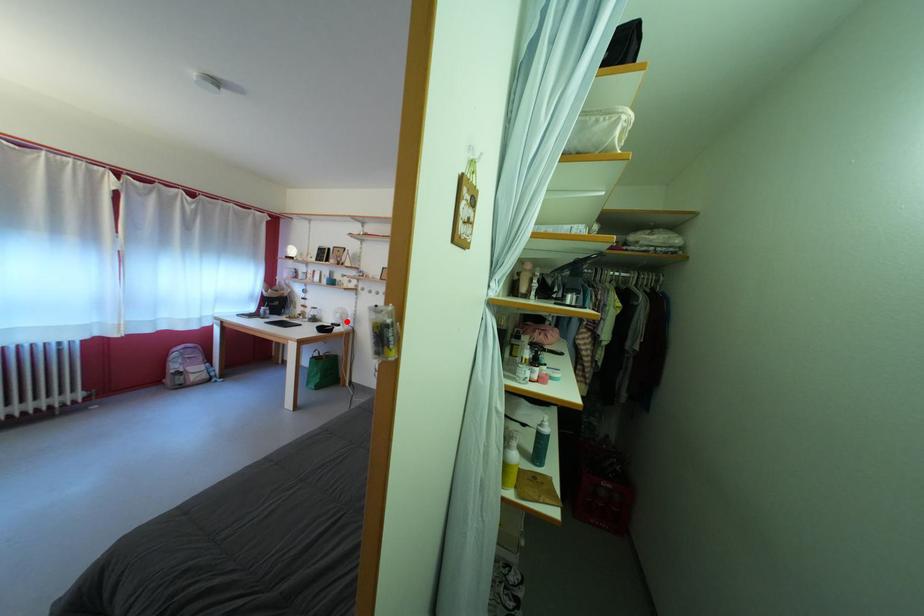
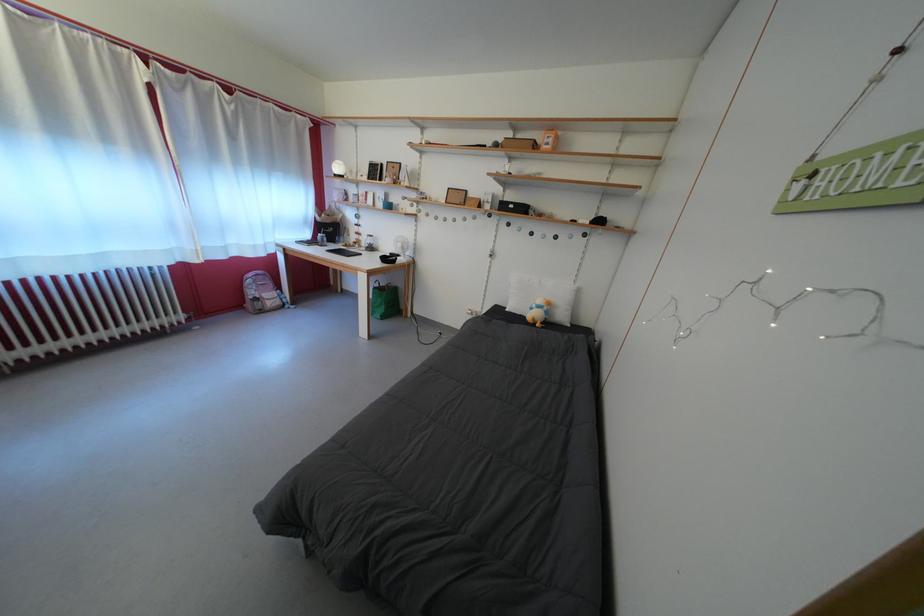
Find the pixel in the second image that matches the highlighted location in the first image.

(407, 251)